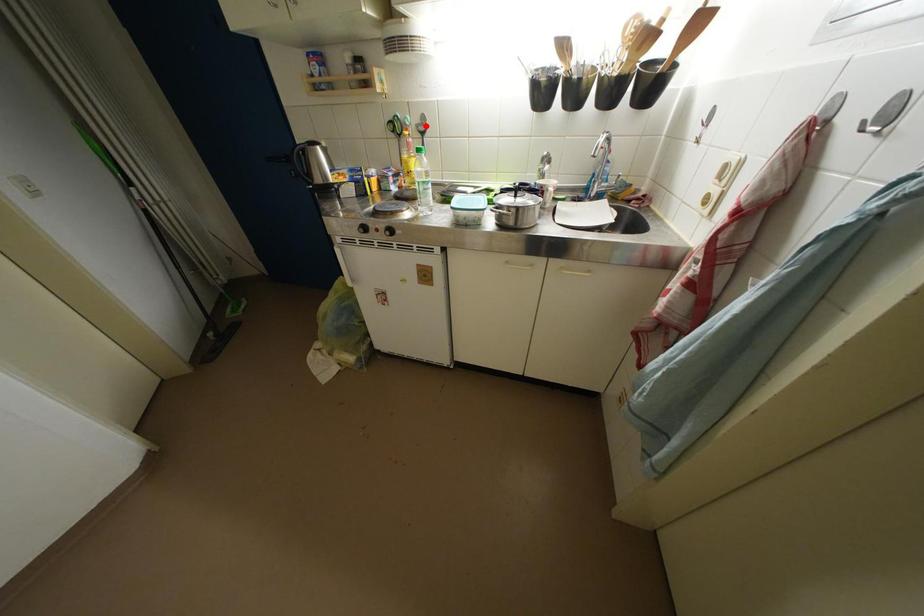
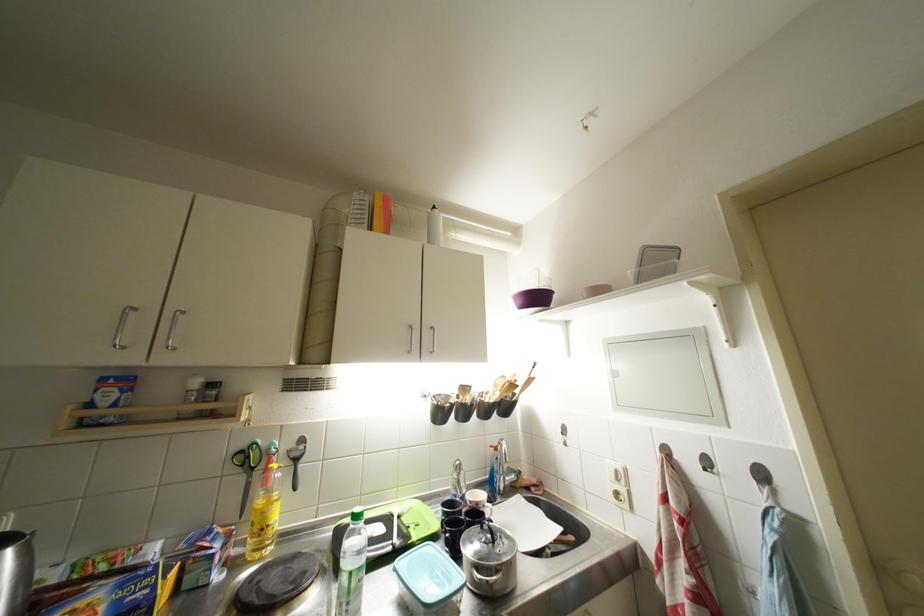
Question: I am providing you with two images of the same scene from different viewpoints. A red point is shown in image1. For the corresponding object point in image2, is it positioned nearer or farther from the camera?

Choices:
 (A) Nearer
 (B) Farther

Answer: (B)